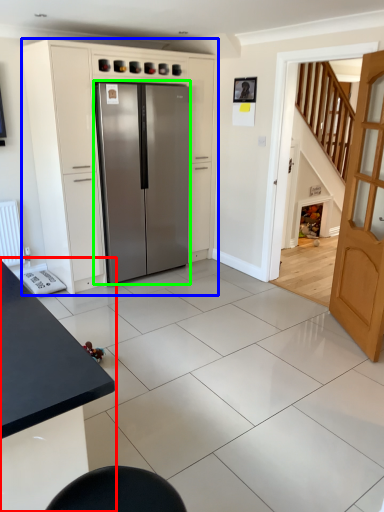
Question: Based on their relative distances, which object is farther from table (highlighted by a red box)? Choose from cabinetry (highlighted by a blue box) and refrigerator (highlighted by a green box).

Choices:
 (A) cabinetry
 (B) refrigerator

Answer: (A)